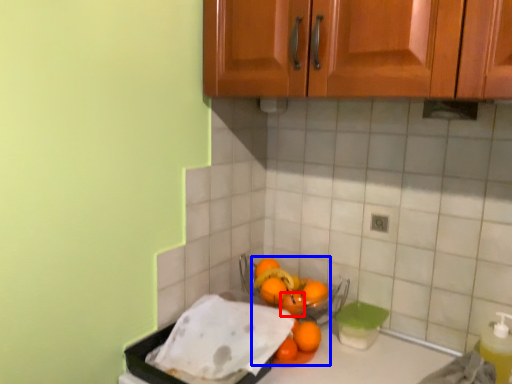
Question: Which point is closer to the camera, orange (highlighted by a red box) or wash (highlighted by a blue box)?

Choices:
 (A) orange
 (B) wash

Answer: (B)